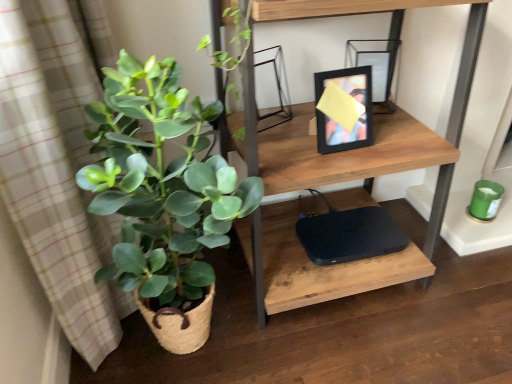
Question: Considering the relative sizes of wooden shelf at upper center and black matte computer at lower center in the image provided, is wooden shelf at upper center bigger than black matte computer at lower center?

Choices:
 (A) no
 (B) yes

Answer: (B)

Question: From a real-world perspective, does wooden shelf at upper center stand above black matte computer at lower center?

Choices:
 (A) no
 (B) yes

Answer: (B)

Question: Is wooden shelf at upper center next to black matte computer at lower center and touching it?

Choices:
 (A) yes
 (B) no

Answer: (B)

Question: Considering the relative sizes of wooden shelf at upper center and black matte computer at lower center in the image provided, is wooden shelf at upper center shorter than black matte computer at lower center?

Choices:
 (A) no
 (B) yes

Answer: (A)

Question: Does wooden shelf at upper center have a greater width compared to black matte computer at lower center?

Choices:
 (A) no
 (B) yes

Answer: (B)

Question: In the image, is black matte computer at lower center positioned in front of or behind green woven basket at left?

Choices:
 (A) front
 (B) behind

Answer: (B)

Question: From the image's perspective, is black matte computer at lower center above or below green woven basket at left?

Choices:
 (A) above
 (B) below

Answer: (B)

Question: Based on their sizes in the image, would you say black matte computer at lower center is bigger or smaller than green woven basket at left?

Choices:
 (A) big
 (B) small

Answer: (B)

Question: Is black matte computer at lower center wider or thinner than green woven basket at left?

Choices:
 (A) wide
 (B) thin

Answer: (B)

Question: From the image's perspective, is green woven basket at left above or below black matte computer at lower center?

Choices:
 (A) below
 (B) above

Answer: (B)

Question: From a real-world perspective, relative to black matte computer at lower center, is green woven basket at left vertically above or below?

Choices:
 (A) below
 (B) above

Answer: (B)

Question: Considering the positions of green woven basket at left and black matte computer at lower center in the image, is green woven basket at left bigger or smaller than black matte computer at lower center?

Choices:
 (A) big
 (B) small

Answer: (A)

Question: Which is correct: green woven basket at left is inside black matte computer at lower center, or outside of it?

Choices:
 (A) outside
 (B) inside

Answer: (A)

Question: From the image's perspective, is wooden shelf at upper center located above or below green woven basket at left?

Choices:
 (A) below
 (B) above

Answer: (B)

Question: Looking at the image, does wooden shelf at upper center seem bigger or smaller compared to green woven basket at left?

Choices:
 (A) small
 (B) big

Answer: (B)